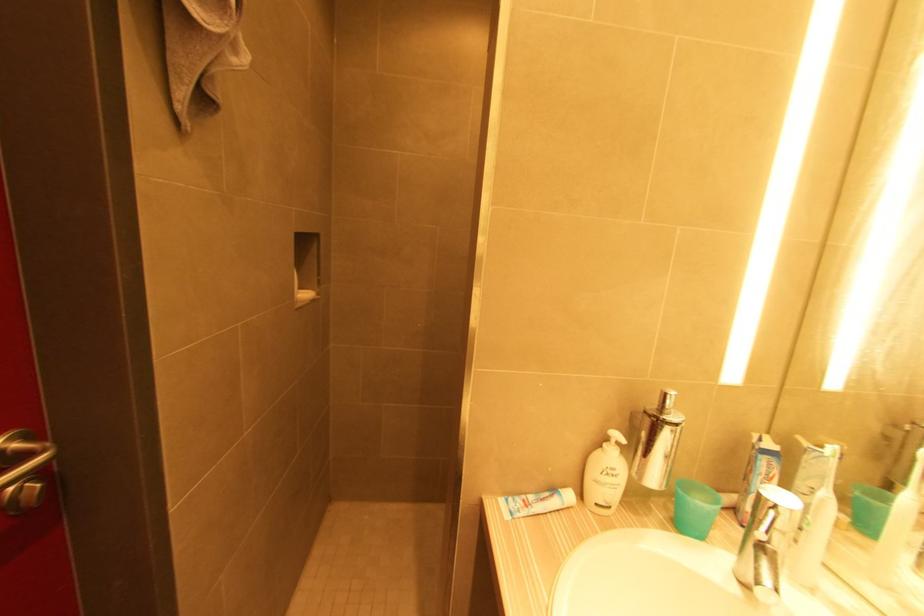
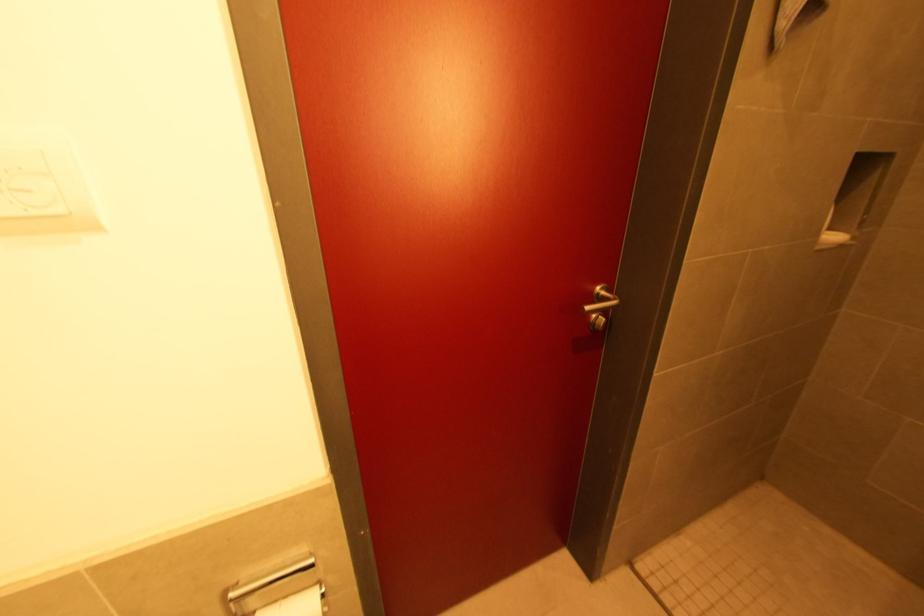
In the second image, find the point that corresponds to the point at 41,487 in the first image.

(606, 321)